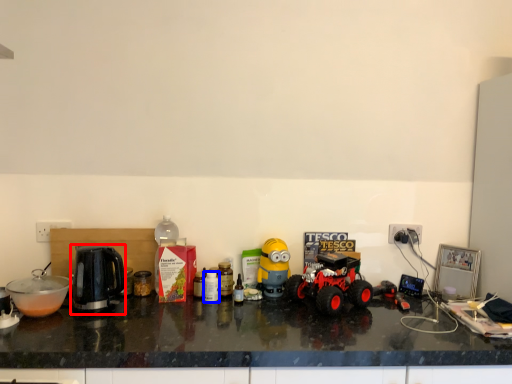
Question: Among these objects, which one is nearest to the camera, kettle (highlighted by a red box) or bottle (highlighted by a blue box)?

Choices:
 (A) kettle
 (B) bottle

Answer: (A)